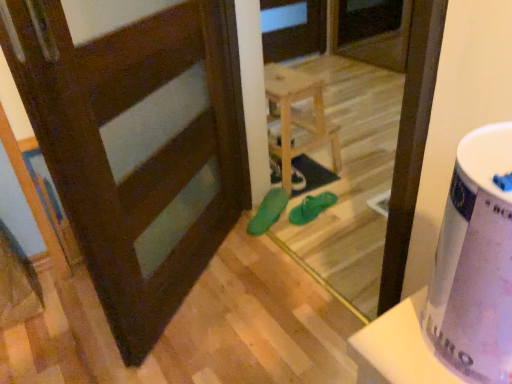
Question: Is green rubber flip-flops at center, which is counted as the 2th footwear, starting from the left, looking in the opposite direction of matte green shoe at center?

Choices:
 (A) yes
 (B) no

Answer: (B)

Question: Does green rubber flip-flops at center, which is the first footwear from right to left, lie behind matte green shoe at center?

Choices:
 (A) yes
 (B) no

Answer: (B)

Question: Is green rubber flip-flops at center, which is counted as the 2th footwear, starting from the left, positioned beyond the bounds of matte green shoe at center?

Choices:
 (A) no
 (B) yes

Answer: (B)

Question: Is green rubber flip-flops at center, which is the first footwear from right to left, far away from matte green shoe at center?

Choices:
 (A) yes
 (B) no

Answer: (B)

Question: Can you confirm if green rubber flip-flops at center, which is the first footwear from right to left, is positioned to the right of matte green shoe at center?

Choices:
 (A) yes
 (B) no

Answer: (A)

Question: Is matte green shoe at center a part of green rubber flip-flops at center, which is the first footwear from right to left?

Choices:
 (A) no
 (B) yes

Answer: (A)

Question: Does green rubber sandals at center, marked as the second footwear in a right-to-left arrangement, have a lesser height compared to green rubber sandals at center?

Choices:
 (A) no
 (B) yes

Answer: (B)

Question: Is green rubber sandals at center, marked as the second footwear in a right-to-left arrangement, not near green rubber sandals at center?

Choices:
 (A) yes
 (B) no

Answer: (B)

Question: Is green rubber sandals at center, arranged as the 1th footwear when viewed from the left, not inside green rubber sandals at center?

Choices:
 (A) yes
 (B) no

Answer: (B)

Question: Is green rubber sandals at center, arranged as the 1th footwear when viewed from the left, bigger than green rubber sandals at center?

Choices:
 (A) yes
 (B) no

Answer: (B)

Question: Is green rubber sandals at center, marked as the second footwear in a right-to-left arrangement, behind green rubber sandals at center?

Choices:
 (A) no
 (B) yes

Answer: (B)

Question: From the image's perspective, is green rubber sandals at center, marked as the second footwear in a right-to-left arrangement, located beneath green rubber sandals at center?

Choices:
 (A) yes
 (B) no

Answer: (A)

Question: Can you confirm if green rubber sandals at center, arranged as the 1th footwear when viewed from the left, is wider than light wood stool at center?

Choices:
 (A) no
 (B) yes

Answer: (A)